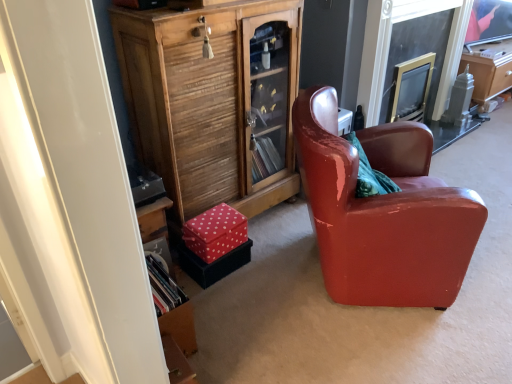
Question: Choose the correct answer: Is wooden cabinet at lower left inside glossy leather armchair at center or outside it?

Choices:
 (A) inside
 (B) outside

Answer: (B)

Question: From the image's perspective, is wooden cabinet at lower left located above or below glossy leather armchair at center?

Choices:
 (A) below
 (B) above

Answer: (B)

Question: From a real-world perspective, is wooden cabinet at lower left above or below glossy leather armchair at center?

Choices:
 (A) above
 (B) below

Answer: (A)

Question: From a real-world perspective, is glossy leather armchair at center above or below wooden cabinet at lower left?

Choices:
 (A) above
 (B) below

Answer: (B)

Question: Which is correct: glossy leather armchair at center is inside wooden cabinet at lower left, or outside of it?

Choices:
 (A) outside
 (B) inside

Answer: (A)

Question: In terms of width, does glossy leather armchair at center look wider or thinner when compared to wooden cabinet at lower left?

Choices:
 (A) wide
 (B) thin

Answer: (A)

Question: Is point (328, 228) closer or farther from the camera than point (184, 89)?

Choices:
 (A) farther
 (B) closer

Answer: (B)